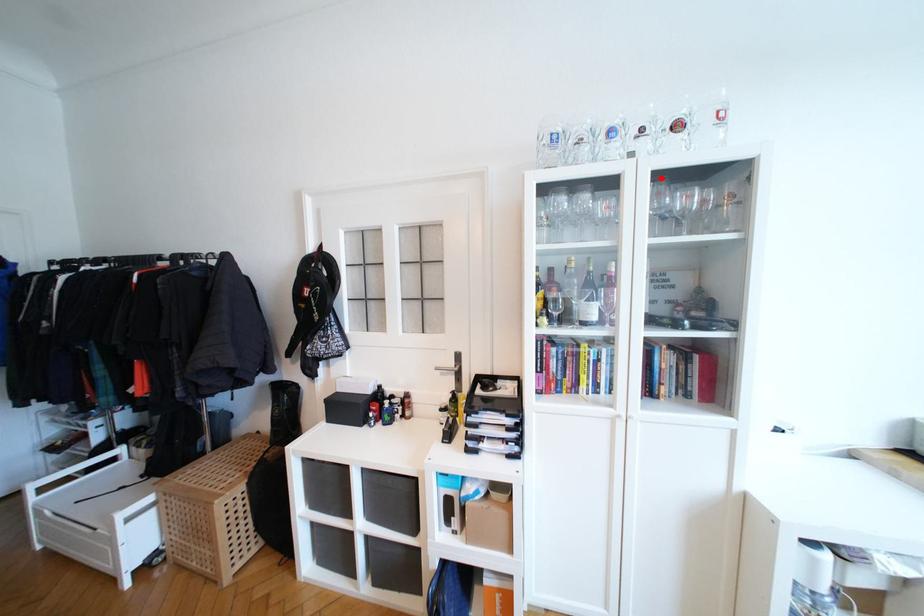
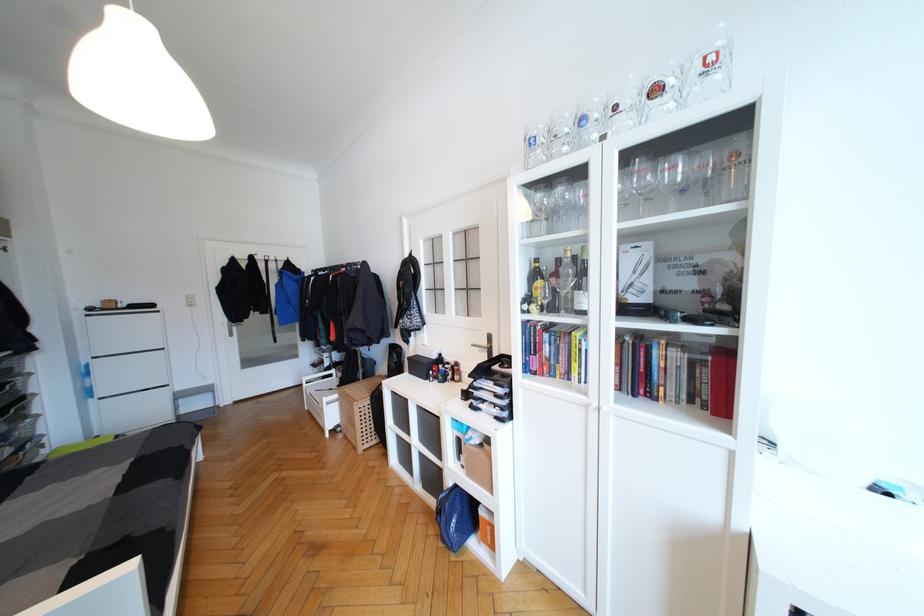
In the second image, find the point that corresponds to the highlighted location in the first image.

(631, 156)